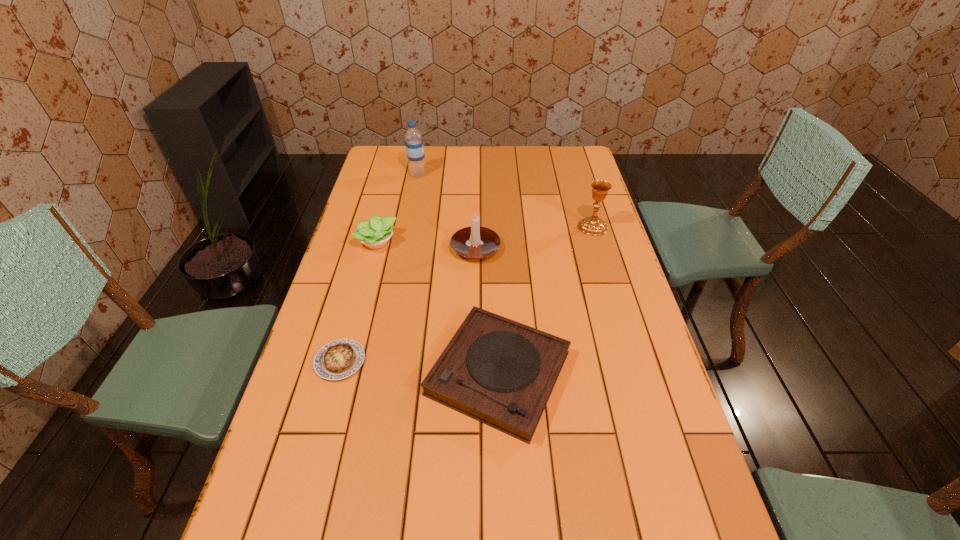
Locate an element on the screen. This screenshot has height=540, width=960. vacant region at the far left corner is located at coordinates (394, 156).

Locate an element on the screen. The image size is (960, 540). free space at the far right corner of the desktop is located at coordinates (581, 151).

Find the location of `free space between the phonograph record and the shortest object`. free space between the phonograph record and the shortest object is located at coordinates (420, 367).

What are the coordinates of `free space between the farthest object and the rightmost object` in the screenshot? It's located at (505, 201).

Locate an element on the screen. The image size is (960, 540). free space that is in between the farthest object and the lettuce is located at coordinates (397, 208).

At what (x,y) coordinates should I click in order to perform the action: click on blank region between the lettuce and the water bottle. Please return your answer as a coordinate pair (x, y). The image size is (960, 540). Looking at the image, I should click on (397, 208).

Locate an element on the screen. free space between the quiche and the rightmost object is located at coordinates (467, 294).

Image resolution: width=960 pixels, height=540 pixels. Find the location of `vacant area that lies between the quiche and the farthest object`. vacant area that lies between the quiche and the farthest object is located at coordinates (379, 268).

Identify the location of vacant region between the quiche and the water bottle. (379, 268).

The width and height of the screenshot is (960, 540). I want to click on unoccupied area between the quiche and the phonograph record, so click(420, 367).